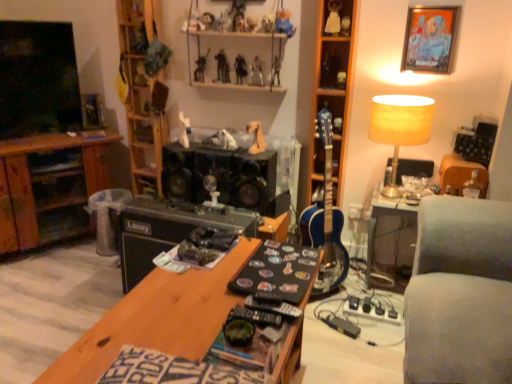
Question: Considering the positions of metallic silver action figure at upper center, which is the fifth toy in right-to-left order, and clear plastic trash bin at center in the image, is metallic silver action figure at upper center, which is the fifth toy in right-to-left order, wider or thinner than clear plastic trash bin at center?

Choices:
 (A) wide
 (B) thin

Answer: (B)

Question: Considering the relative positions of metallic silver action figure at upper center, which is the fifth toy in right-to-left order, and clear plastic trash bin at center in the image provided, is metallic silver action figure at upper center, which is the fifth toy in right-to-left order, to the left or to the right of clear plastic trash bin at center?

Choices:
 (A) left
 (B) right

Answer: (B)

Question: Based on their relative distances, which object is nearer to the metallic silver action figure at upper center, which ranks as the 8th toy in left-to-right order?

Choices:
 (A) gray fabric couch at right
 (B) metallic figure at upper center, marked as the sixth toy in a left-to-right arrangement
 (C) metallic silver figure at upper center, the sixth toy positioned from the right
 (D) blue wood guitar at center-right
 (E) black matte speaker at center

Answer: (B)

Question: Which of these objects is positioned farthest from the gray fabric couch at right?

Choices:
 (A) metallic silver picture frame at upper right
 (B) metallic figure at upper center, the 11th toy from the right
 (C) wooden shelf at upper center, placed as the 2th shelf when sorted from right to left
 (D) orange matte horse at center, arranged as the 9th toy when viewed from the left
 (E) gray fabric couch at right

Answer: (B)